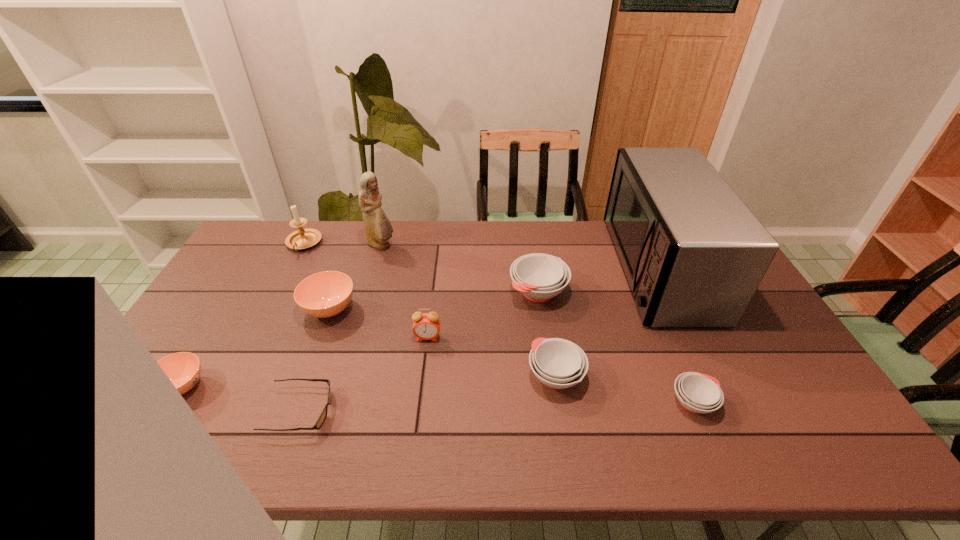
Identify the location of microwave_oven. tap(693, 254).

Where is `figurine`? figurine is located at coordinates (378, 228).

The height and width of the screenshot is (540, 960). Find the location of `beige candle holder`. beige candle holder is located at coordinates (302, 238).

At what (x,y) coordinates should I click in order to perform the action: click on candle holder. Please return your answer as a coordinate pair (x, y). Looking at the image, I should click on (302, 238).

This screenshot has width=960, height=540. Identify the location of alarm clock. (426, 326).

Identify the location of the seventh shortest object. (426, 326).

At what (x,y) coordinates should I click in order to perform the action: click on the farthest white soup bowl. Please return your answer as a coordinate pair (x, y). Looking at the image, I should click on (539, 277).

Find the location of a particular element. the bigger peach soup bowl is located at coordinates (325, 294).

Where is `the right peach soup bowl`? The height and width of the screenshot is (540, 960). the right peach soup bowl is located at coordinates (325, 294).

You are a GUI agent. You are given a task and a screenshot of the screen. Output one action in this format:
    pyautogui.click(x=<x>, y=<y>)
    Task: Click on the second biggest white soup bowl
    
    Given the screenshot: What is the action you would take?
    pyautogui.click(x=558, y=363)